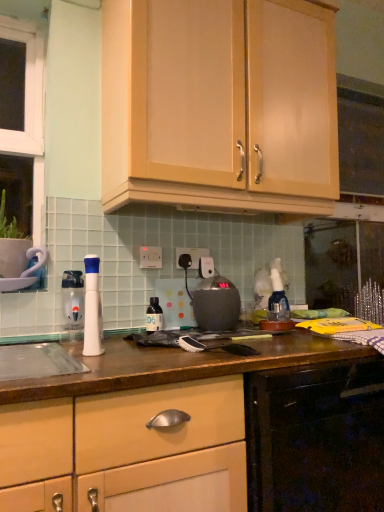
The image size is (384, 512). Describe the element at coordinates (216, 304) in the screenshot. I see `matte black kettle at center` at that location.

Where is `matte black kettle at center`? matte black kettle at center is located at coordinates (216, 304).

Image resolution: width=384 pixels, height=512 pixels. What do you see at coordinates (139, 426) in the screenshot? I see `wooden drawer at center, the 1th cabinetry ordered from the bottom` at bounding box center [139, 426].

Image resolution: width=384 pixels, height=512 pixels. What do you see at coordinates (72, 305) in the screenshot?
I see `translucent plastic bottle at left, which appears as the 2th bottle when viewed from the back` at bounding box center [72, 305].

What do you see at coordinates (192, 256) in the screenshot? I see `white plastic electric outlet at center, the 1th electric outlet from the right` at bounding box center [192, 256].

You are a GUI agent. You are given a task and a screenshot of the screen. Output one action in this format:
    pyautogui.click(x=<x>, y=<y>)
    Task: Click on the translucent plastic bottle at center, which is the 1th bottle from back to front
    The width and height of the screenshot is (384, 512).
    Given the screenshot: What is the action you would take?
    pyautogui.click(x=154, y=316)

How much space does translucent plastic bottle at center, acting as the first bottle starting from the right, occupy horizontally?

It is 4.68 centimeters.

The width and height of the screenshot is (384, 512). I want to click on matte black kettle at center, so click(216, 304).

Does point (158, 262) appear closer or farther from the camera than point (158, 323)?

Clearly, point (158, 262) is more distant from the camera than point (158, 323).

Does white plastic electric outlet at center, marked as the second electric outlet in a right-to-left arrangement, have a greater width compared to translucent plastic bottle at center, the 2th bottle from the left?

No, white plastic electric outlet at center, marked as the second electric outlet in a right-to-left arrangement, is not wider than translucent plastic bottle at center, the 2th bottle from the left.

What's the angular difference between white plastic electric outlet at center, which is counted as the 1th electric outlet, starting from the front, and translucent plastic bottle at center, acting as the first bottle starting from the right,'s facing directions?

There is a 0.00928-degree angle between the facing directions of white plastic electric outlet at center, which is counted as the 1th electric outlet, starting from the front, and translucent plastic bottle at center, acting as the first bottle starting from the right.

Is white plastic electric outlet at center, arranged as the 2th electric outlet when viewed from the back, smaller than translucent plastic bottle at center, the 2th bottle from the left?

Yes, white plastic electric outlet at center, arranged as the 2th electric outlet when viewed from the back, is smaller than translucent plastic bottle at center, the 2th bottle from the left.

Is matte wood cabinet at upper center, arranged as the first cabinetry when viewed from the top, placed right next to wooden drawer at center, placed as the second cabinetry when sorted from top to bottom?

matte wood cabinet at upper center, arranged as the first cabinetry when viewed from the top, and wooden drawer at center, placed as the second cabinetry when sorted from top to bottom, are clearly separated.

From the image's perspective, is matte wood cabinet at upper center, arranged as the first cabinetry when viewed from the top, located above wooden drawer at center, the 1th cabinetry ordered from the bottom?

Yes, from the image's perspective, matte wood cabinet at upper center, arranged as the first cabinetry when viewed from the top, is over wooden drawer at center, the 1th cabinetry ordered from the bottom.

Which of these two, matte wood cabinet at upper center, arranged as the first cabinetry when viewed from the top, or wooden drawer at center, placed as the second cabinetry when sorted from top to bottom, stands taller?

matte wood cabinet at upper center, arranged as the first cabinetry when viewed from the top.

The height and width of the screenshot is (512, 384). In order to click on cabinetry lying above the wooden drawer at center, the 1th cabinetry ordered from the bottom (from the image's perspective) in this screenshot , I will do `click(220, 105)`.

How many degrees apart are the facing directions of translucent plastic bottle at center, which is the 1th bottle from back to front, and matte wood cabinet at upper center, arranged as the first cabinetry when viewed from the top?

There is a 0.003-degree angle between the facing directions of translucent plastic bottle at center, which is the 1th bottle from back to front, and matte wood cabinet at upper center, arranged as the first cabinetry when viewed from the top.

From their relative heights in the image, would you say translucent plastic bottle at center, which is the 1th bottle from back to front, is taller or shorter than matte wood cabinet at upper center, arranged as the first cabinetry when viewed from the top?

In the image, translucent plastic bottle at center, which is the 1th bottle from back to front, appears to be shorter than matte wood cabinet at upper center, arranged as the first cabinetry when viewed from the top.

From the picture: Would you say translucent plastic bottle at center, which is the 1th bottle from back to front, is a long distance from matte wood cabinet at upper center, arranged as the first cabinetry when viewed from the top?

translucent plastic bottle at center, which is the 1th bottle from back to front, is near matte wood cabinet at upper center, arranged as the first cabinetry when viewed from the top, not far away.

Which is more to the right, translucent plastic bottle at center, which is the 2th bottle in front-to-back order, or matte wood cabinet at upper center, the 2th cabinetry in the bottom-to-top sequence?

matte wood cabinet at upper center, the 2th cabinetry in the bottom-to-top sequence.

From the picture: From a real-world perspective, is matte wood cabinet at upper center, arranged as the first cabinetry when viewed from the top, physically above translucent plastic bottle at left, which appears as the 2th bottle when viewed from the back?

Correct, in the physical world, matte wood cabinet at upper center, arranged as the first cabinetry when viewed from the top, is higher than translucent plastic bottle at left, which appears as the 2th bottle when viewed from the back.

Consider the image. How many degrees apart are the facing directions of matte wood cabinet at upper center, the 2th cabinetry in the bottom-to-top sequence, and translucent plastic bottle at left, the 1th bottle in the front-to-back sequence?

0.00282 degrees separate the facing orientations of matte wood cabinet at upper center, the 2th cabinetry in the bottom-to-top sequence, and translucent plastic bottle at left, the 1th bottle in the front-to-back sequence.

Is matte wood cabinet at upper center, arranged as the first cabinetry when viewed from the top, situated inside translucent plastic bottle at left, which is counted as the second bottle, starting from the right, or outside?

matte wood cabinet at upper center, arranged as the first cabinetry when viewed from the top, is spatially situated outside translucent plastic bottle at left, which is counted as the second bottle, starting from the right.

Where is `cabinetry lying above the translucent plastic bottle at left, positioned as the 1th bottle in left-to-right order (from the image's perspective)`? This screenshot has width=384, height=512. cabinetry lying above the translucent plastic bottle at left, positioned as the 1th bottle in left-to-right order (from the image's perspective) is located at coordinates (220, 105).

Between white plastic electric outlet at center, marked as the second electric outlet in a right-to-left arrangement, and matte black kettle at center, which one appears on the right side from the viewer's perspective?

From the viewer's perspective, matte black kettle at center appears more on the right side.

Which point is more distant from viewer, (153, 249) or (218, 308)?

Point (153, 249)

From the image's perspective, which is above, white plastic electric outlet at center, marked as the second electric outlet in a right-to-left arrangement, or matte black kettle at center?

From the image's view, white plastic electric outlet at center, marked as the second electric outlet in a right-to-left arrangement, is above.

Is white plastic electric outlet at center, arranged as the 2th electric outlet when viewed from the back, not inside matte black kettle at center?

Yes.

In the image, is matte wood cabinet at upper center, arranged as the first cabinetry when viewed from the top, positioned in front of or behind white plastic electric outlet at center, arranged as the 2th electric outlet when viewed from the back?

matte wood cabinet at upper center, arranged as the first cabinetry when viewed from the top, is positioned closer to the viewer than white plastic electric outlet at center, arranged as the 2th electric outlet when viewed from the back.

Would you say matte wood cabinet at upper center, the 2th cabinetry in the bottom-to-top sequence, is a long distance from white plastic electric outlet at center, marked as the second electric outlet in a right-to-left arrangement?

No, matte wood cabinet at upper center, the 2th cabinetry in the bottom-to-top sequence, is not far from white plastic electric outlet at center, marked as the second electric outlet in a right-to-left arrangement.

Is white plastic electric outlet at center, arranged as the 1th electric outlet when viewed from the left, located within matte wood cabinet at upper center, the 2th cabinetry in the bottom-to-top sequence?

No, white plastic electric outlet at center, arranged as the 1th electric outlet when viewed from the left, is not a part of matte wood cabinet at upper center, the 2th cabinetry in the bottom-to-top sequence.

From a real-world perspective, is matte wood cabinet at upper center, arranged as the first cabinetry when viewed from the top, above or below white plastic electric outlet at center, which is counted as the 1th electric outlet, starting from the front?

Clearly, from a real-world perspective, matte wood cabinet at upper center, arranged as the first cabinetry when viewed from the top, is above white plastic electric outlet at center, which is counted as the 1th electric outlet, starting from the front.

Which is more to the left, wooden drawer at center, placed as the second cabinetry when sorted from top to bottom, or white plastic electric outlet at center, arranged as the 1th electric outlet when viewed from the left?

white plastic electric outlet at center, arranged as the 1th electric outlet when viewed from the left, is more to the left.

From a real-world perspective, is wooden drawer at center, placed as the second cabinetry when sorted from top to bottom, over white plastic electric outlet at center, marked as the second electric outlet in a right-to-left arrangement?

No.

Considering the sizes of wooden drawer at center, the 1th cabinetry ordered from the bottom, and white plastic electric outlet at center, arranged as the 1th electric outlet when viewed from the left, in the image, is wooden drawer at center, the 1th cabinetry ordered from the bottom, taller or shorter than white plastic electric outlet at center, arranged as the 1th electric outlet when viewed from the left,?

wooden drawer at center, the 1th cabinetry ordered from the bottom, is taller than white plastic electric outlet at center, arranged as the 1th electric outlet when viewed from the left.

Considering the positions of point (38, 479) and point (140, 262), is point (38, 479) closer or farther from the camera than point (140, 262)?

Point (38, 479) appears to be closer to the viewer than point (140, 262).

You are a GUI agent. You are given a task and a screenshot of the screen. Output one action in this format:
    pyautogui.click(x=<x>, y=<y>)
    Task: Click on the bottle that is the 2nd object located below the white plastic electric outlet at center, which is counted as the 1th electric outlet, starting from the front (from the image's perspective)
    The image size is (384, 512).
    Given the screenshot: What is the action you would take?
    pyautogui.click(x=154, y=316)

Image resolution: width=384 pixels, height=512 pixels. I want to click on cabinetry that appears in front of the matte wood cabinet at upper center, the 2th cabinetry in the bottom-to-top sequence, so click(139, 426).

Estimate the real-world distances between objects in this image. Which object is further from white plastic electric outlet at center, arranged as the 1th electric outlet when viewed from the left, matte black kettle at center or translucent plastic bottle at left, the 1th bottle in the front-to-back sequence?

translucent plastic bottle at left, the 1th bottle in the front-to-back sequence, lies further to white plastic electric outlet at center, arranged as the 1th electric outlet when viewed from the left, than the other object.

When comparing their distances from matte wood cabinet at upper center, the 2th cabinetry in the bottom-to-top sequence, does white plastic electric outlet at center, the second electric outlet from the front, or wooden drawer at center, the 1th cabinetry ordered from the bottom, seem closer?

Based on the image, white plastic electric outlet at center, the second electric outlet from the front, appears to be nearer to matte wood cabinet at upper center, the 2th cabinetry in the bottom-to-top sequence.

Which object lies nearer to the anchor point white plastic electric outlet at center, marked as the second electric outlet in a right-to-left arrangement, matte wood cabinet at upper center, the 2th cabinetry in the bottom-to-top sequence, or translucent plastic bottle at left, the 1th bottle in the front-to-back sequence?

translucent plastic bottle at left, the 1th bottle in the front-to-back sequence, is closer to white plastic electric outlet at center, marked as the second electric outlet in a right-to-left arrangement.

From the picture: Looking at the image, which one is located further to translucent plastic bottle at left, which is counted as the second bottle, starting from the right, white plastic electric outlet at center, the second electric outlet from the front, or translucent plastic bottle at center, the 2th bottle from the left?

Among the two, white plastic electric outlet at center, the second electric outlet from the front, is located further to translucent plastic bottle at left, which is counted as the second bottle, starting from the right.

Which object lies further to the anchor point translucent plastic bottle at left, which appears as the 2th bottle when viewed from the back, translucent plastic bottle at center, which is the 1th bottle from back to front, or matte wood cabinet at upper center, the 2th cabinetry in the bottom-to-top sequence?

matte wood cabinet at upper center, the 2th cabinetry in the bottom-to-top sequence, is further to translucent plastic bottle at left, which appears as the 2th bottle when viewed from the back.

Which object lies nearer to the anchor point translucent plastic bottle at center, acting as the first bottle starting from the right, matte black kettle at center or matte wood cabinet at upper center, the 2th cabinetry in the bottom-to-top sequence?

matte black kettle at center is closer to translucent plastic bottle at center, acting as the first bottle starting from the right.

Looking at the image, which one is located closer to white plastic electric outlet at center, placed as the 1th electric outlet when sorted from back to front, matte wood cabinet at upper center, arranged as the first cabinetry when viewed from the top, or white plastic electric outlet at center, arranged as the 2th electric outlet when viewed from the back?

Based on the image, white plastic electric outlet at center, arranged as the 2th electric outlet when viewed from the back, appears to be nearer to white plastic electric outlet at center, placed as the 1th electric outlet when sorted from back to front.

Looking at the image, which one is located further to wooden drawer at center, the 1th cabinetry ordered from the bottom, white plastic electric outlet at center, arranged as the 1th electric outlet when viewed from the left, or matte black kettle at center?

Based on the image, white plastic electric outlet at center, arranged as the 1th electric outlet when viewed from the left, appears to be further to wooden drawer at center, the 1th cabinetry ordered from the bottom.

At what (x,y) coordinates should I click in order to perform the action: click on appliance that lies between matte wood cabinet at upper center, the 2th cabinetry in the bottom-to-top sequence, and translucent plastic bottle at center, which is the 1th bottle from back to front, from top to bottom. Please return your answer as a coordinate pair (x, y). Image resolution: width=384 pixels, height=512 pixels. Looking at the image, I should click on (216, 304).

The width and height of the screenshot is (384, 512). Find the location of `electric outlet between white plastic electric outlet at center, arranged as the 1th electric outlet when viewed from the left, and matte black kettle at center`. electric outlet between white plastic electric outlet at center, arranged as the 1th electric outlet when viewed from the left, and matte black kettle at center is located at coordinates (192, 256).

The width and height of the screenshot is (384, 512). I want to click on electric outlet between wooden drawer at center, placed as the second cabinetry when sorted from top to bottom, and white plastic electric outlet at center, the 1th electric outlet from the right, from front to back, so click(150, 257).

This screenshot has width=384, height=512. In order to click on appliance between wooden drawer at center, placed as the second cabinetry when sorted from top to bottom, and translucent plastic bottle at center, which is the 1th bottle from back to front, from front to back in this screenshot , I will do `click(216, 304)`.